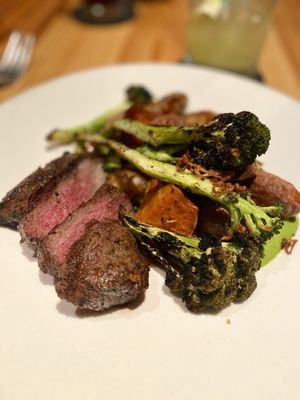
Where is `drinking glass`? drinking glass is located at coordinates (220, 38).